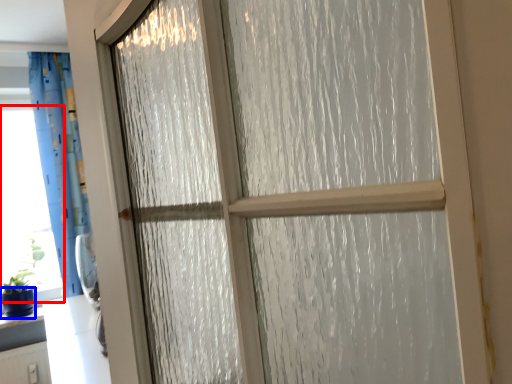
Question: Which object is further to the camera taking this photo, window screen (highlighted by a red box) or glass vase (highlighted by a blue box)?

Choices:
 (A) window screen
 (B) glass vase

Answer: (A)